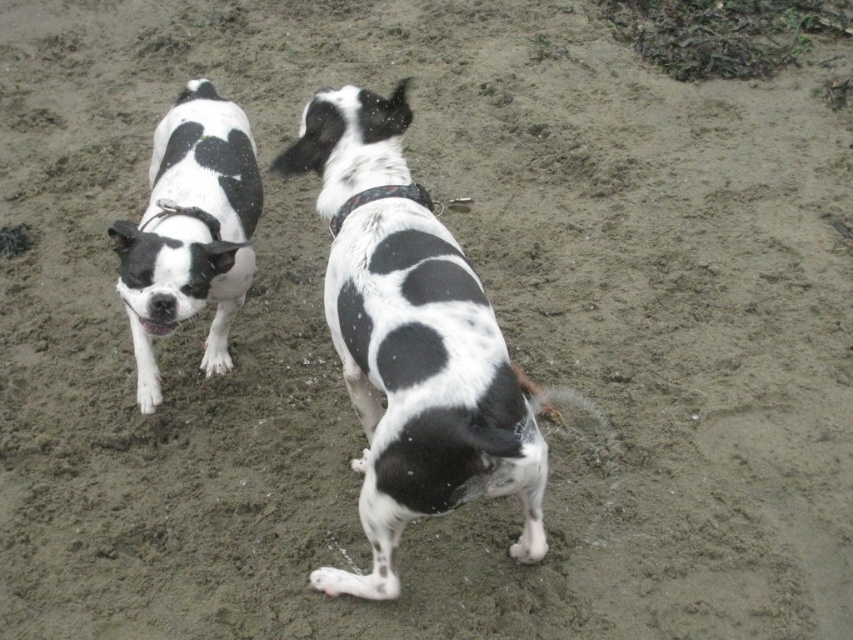
You are a photographer trying to capture both dogs in a single frame. Given that the black and white fur dog at center and the black and white fur dog at left are positioned differently, which dog should you focus on first to ensure both are in focus?

The black and white fur dog at center is taller than the black and white fur dog at left. To ensure both are in focus, you should focus on the taller dog first, which is the black and white fur dog at center, as depth of field typically extends further behind the point of focus than in front.

You are a photographer trying to capture a clear photo of the black fabric collar at center. However, the black and white fur dog at left is blocking your view. Can you move the dog to get a clear shot of the collar?

The black fabric collar at center is behind the black and white fur dog at left, so you need to move the dog to the side to get a clear view of the collar.

You are a photographer trying to capture a clear shot of the black fabric collar at center and the black and white fur dog at center. Which object should you focus on first if you want to ensure both are in focus?

You should focus on the black and white fur dog at center first because it is located below the black fabric collar at center, meaning it is farther away from the camera. By focusing on the farther object first, you can adjust the focus to include both in the frame.